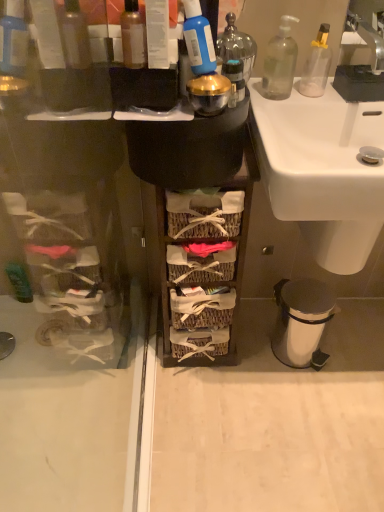
Question: Is translucent glass bottle at upper center, which is the 2th bottle in front-to-back order, looking in the opposite direction of translucent plastic bottle at upper center, which is the 1th bottle from left to right?

Choices:
 (A) no
 (B) yes

Answer: (A)

Question: Is translucent glass bottle at upper center, which is the 2th bottle in front-to-back order, behind translucent plastic bottle at upper center, which is counted as the 1th bottle, starting from the front?

Choices:
 (A) yes
 (B) no

Answer: (A)

Question: Would you say translucent glass bottle at upper center, the 2th bottle in the left-to-right sequence, is a long distance from translucent plastic bottle at upper center, which ranks as the 3th bottle in right-to-left order?

Choices:
 (A) yes
 (B) no

Answer: (B)

Question: From the image's perspective, does translucent glass bottle at upper center, which is the 2th bottle in front-to-back order, appear lower than translucent plastic bottle at upper center, which is counted as the 1th bottle, starting from the front?

Choices:
 (A) no
 (B) yes

Answer: (A)

Question: Is translucent glass bottle at upper center, which appears as the 2th bottle when viewed from the right, positioned in front of translucent plastic bottle at upper center, which is the 1th bottle from left to right?

Choices:
 (A) no
 (B) yes

Answer: (A)

Question: In the image, is translucent glass bottle at upper center, acting as the 2th bottle starting from the back, on the left side or the right side of white plastic trash can at lower right?

Choices:
 (A) right
 (B) left

Answer: (B)

Question: Is translucent glass bottle at upper center, acting as the 2th bottle starting from the back, inside the boundaries of white plastic trash can at lower right, or outside?

Choices:
 (A) inside
 (B) outside

Answer: (B)

Question: From a real-world perspective, is translucent glass bottle at upper center, which is the 2th bottle in front-to-back order, positioned above or below white plastic trash can at lower right?

Choices:
 (A) below
 (B) above

Answer: (B)

Question: Is point (225, 38) positioned closer to the camera than point (286, 352)?

Choices:
 (A) farther
 (B) closer

Answer: (B)

Question: Is transparent glass soap dispenser at upper right, which is the first bottle from back to front, taller or shorter than blue plastic bottle at upper center?

Choices:
 (A) short
 (B) tall

Answer: (B)

Question: From a real-world perspective, is transparent glass soap dispenser at upper right, arranged as the first bottle when viewed from the right, positioned above or below blue plastic bottle at upper center?

Choices:
 (A) above
 (B) below

Answer: (B)

Question: Considering the positions of transparent glass soap dispenser at upper right, arranged as the first bottle when viewed from the right, and blue plastic bottle at upper center in the image, is transparent glass soap dispenser at upper right, arranged as the first bottle when viewed from the right, wider or thinner than blue plastic bottle at upper center?

Choices:
 (A) wide
 (B) thin

Answer: (A)

Question: From the image's perspective, is transparent glass soap dispenser at upper right, which is the first bottle from back to front, located above or below blue plastic bottle at upper center?

Choices:
 (A) above
 (B) below

Answer: (A)

Question: Is translucent glass bottle at upper center, which is the 2th bottle in front-to-back order, spatially inside white ceramic sink at center, or outside of it?

Choices:
 (A) outside
 (B) inside

Answer: (A)

Question: From a real-world perspective, is translucent glass bottle at upper center, which is the 2th bottle in front-to-back order, above or below white ceramic sink at center?

Choices:
 (A) below
 (B) above

Answer: (B)